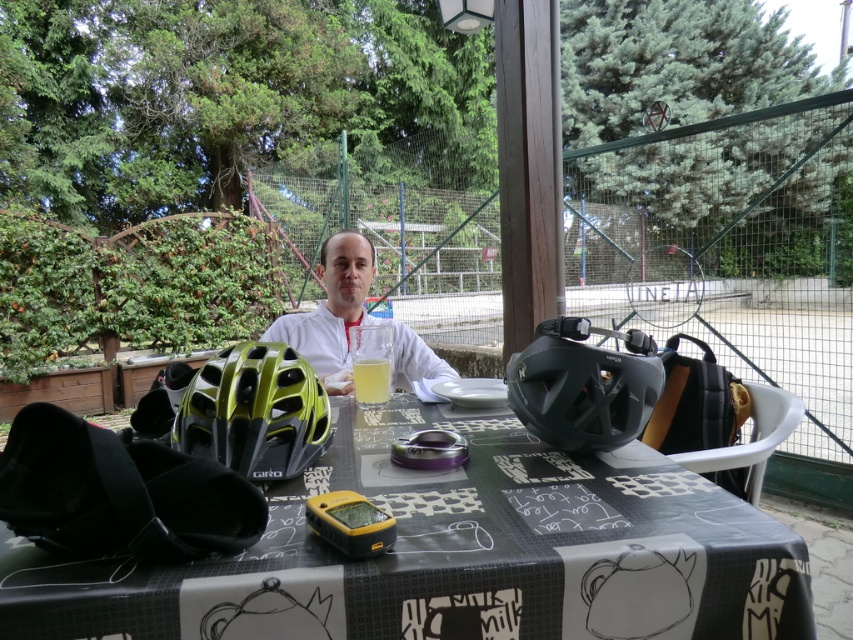
Question: Is black matte table at center bigger than yellow-green matte bicycle helmet at lower left?

Choices:
 (A) yes
 (B) no

Answer: (A)

Question: Which point is closer to the camera?

Choices:
 (A) (242, 356)
 (B) (358, 404)

Answer: (A)

Question: Which point is farther from the camera taking this photo?

Choices:
 (A) (563, 429)
 (B) (195, 433)
 (C) (358, 362)
 (D) (329, 273)

Answer: (D)

Question: Does black matte helmet at center have a lesser width compared to white matte shirt at center?

Choices:
 (A) no
 (B) yes

Answer: (B)

Question: Among these objects, which one is nearest to the camera?

Choices:
 (A) translucent glass at center
 (B) black matte helmet at center

Answer: (B)

Question: Observing the image, what is the correct spatial positioning of black matte table at center in reference to yellow-green matte bicycle helmet at lower left?

Choices:
 (A) left
 (B) right

Answer: (B)